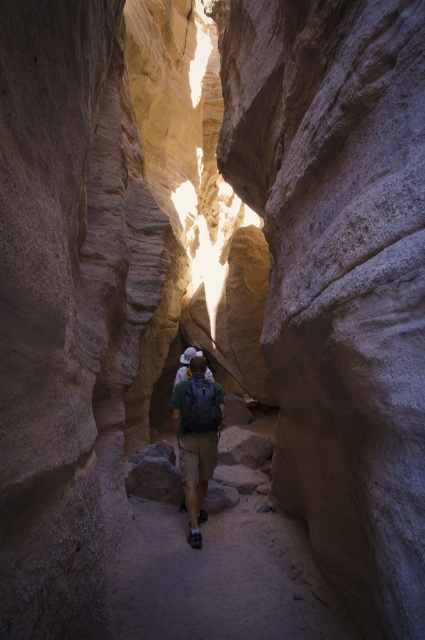
You are hiking through the canyon and see the brown dirt path at center and the green fabric backpack at center. Which object takes up more space in the image?

The brown dirt path at center is larger in size than the green fabric backpack at center, so it takes up more space in the image.

You are hiking through the narrow canyon and see the brown dirt path at center and the green fabric backpack at center. Which object is located to the right of the other?

The brown dirt path at center is positioned on the right side of green fabric backpack at center.